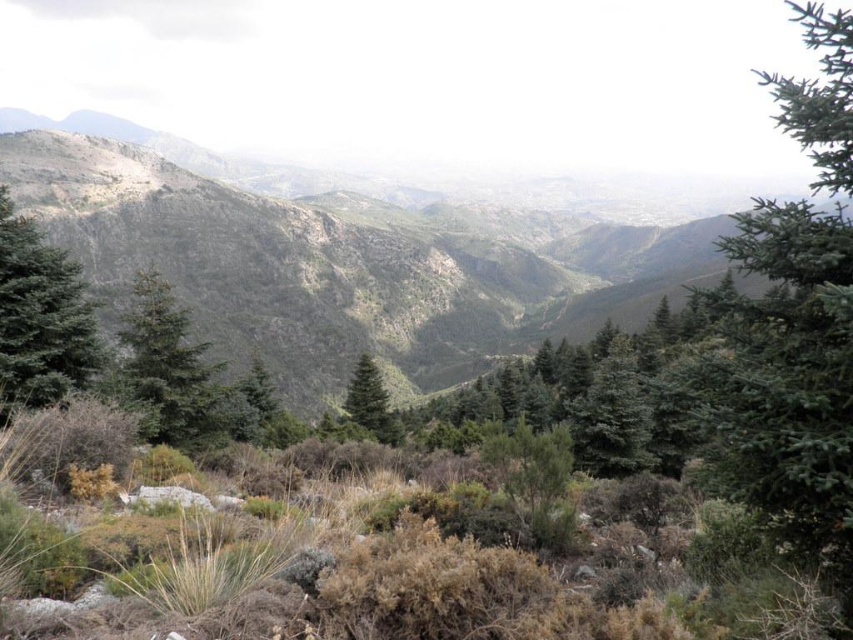
Can you confirm if green matte tree at upper left is wider than green matte tree at center-left?

In fact, green matte tree at upper left might be narrower than green matte tree at center-left.

Is green matte tree at upper left to the right of green matte tree at center-left from the viewer's perspective?

Incorrect, green matte tree at upper left is not on the right side of green matte tree at center-left.

Between point (21, 369) and point (169, 436), which one is positioned in front?

Point (21, 369) is in front.

Where is `green matte tree at upper left`? green matte tree at upper left is located at coordinates (39, 317).

Is green matte tree at center-left positioned before green matte tree at center?

Yes, it is.

Does green matte tree at center-left have a smaller size compared to green matte tree at center?

Yes, green matte tree at center-left is smaller than green matte tree at center.

Is point (140, 326) more distant than point (360, 365)?

That is False.

You are a GUI agent. You are given a task and a screenshot of the screen. Output one action in this format:
    pyautogui.click(x=<x>, y=<y>)
    Task: Click on the green matte tree at center-left
    
    Given the screenshot: What is the action you would take?
    pyautogui.click(x=167, y=368)

Which of these two, green textured mountain at center or green matte tree at upper left, stands shorter?

green matte tree at upper left is shorter.

Between point (140, 129) and point (20, 358), which one is positioned behind?

Positioned behind is point (140, 129).

Locate an element on the screen. The image size is (853, 640). green textured mountain at center is located at coordinates (347, 252).